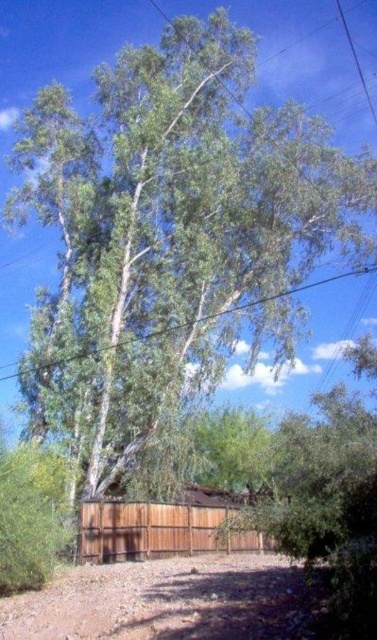
Is the position of brown gravel dirt track at lower center more distant than that of brown wood fence at center?

No, brown gravel dirt track at lower center is closer to the viewer.

Does brown gravel dirt track at lower center have a greater height compared to brown wood fence at center?

No.

The height and width of the screenshot is (640, 377). I want to click on brown gravel dirt track at lower center, so click(x=167, y=602).

Locate an element on the screen. The width and height of the screenshot is (377, 640). brown gravel dirt track at lower center is located at coordinates (167, 602).

Which of these two, brown gravel dirt track at lower center or green leafy tree at upper center, stands taller?

green leafy tree at upper center is taller.

Is brown gravel dirt track at lower center below green leafy tree at upper center?

Yes.

Where is `brown gravel dirt track at lower center`? brown gravel dirt track at lower center is located at coordinates (167, 602).

Is point (262, 544) less distant than point (355, 275)?

Yes, point (262, 544) is closer to viewer.

This screenshot has width=377, height=640. What are the coordinates of `brown wood fence at center` in the screenshot? It's located at 162,531.

Describe the element at coordinates (162, 531) in the screenshot. The width and height of the screenshot is (377, 640). I see `brown wood fence at center` at that location.

The image size is (377, 640). In order to click on brown wood fence at center in this screenshot , I will do `click(162, 531)`.